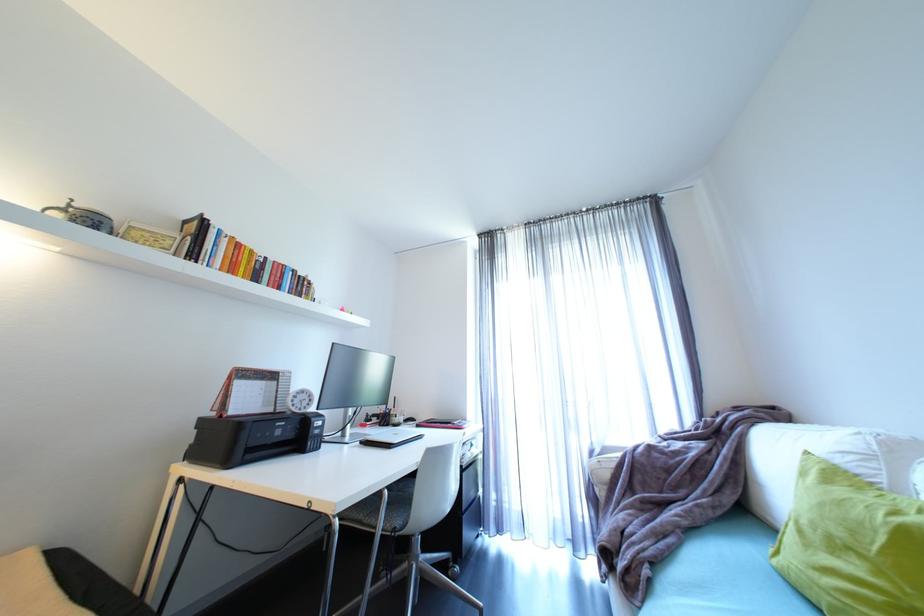
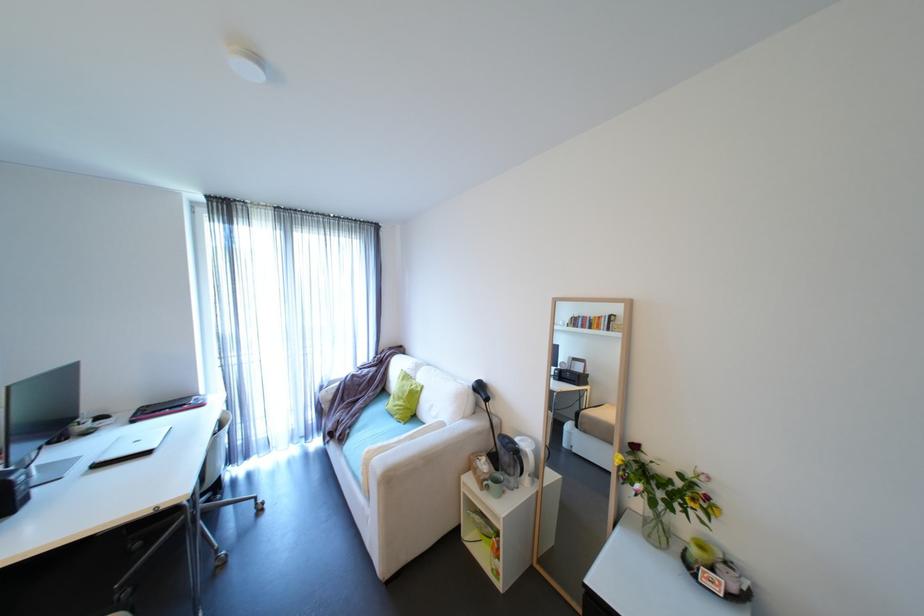
In the second image, find the point that corresponds to point (885, 573) in the first image.

(411, 402)